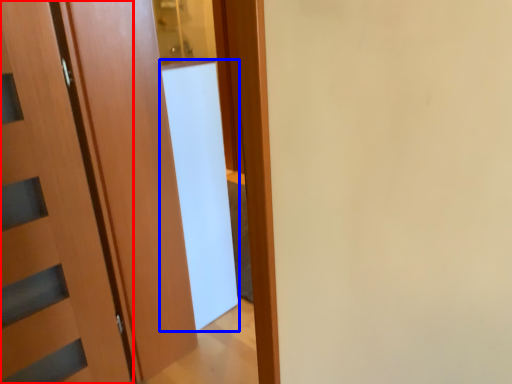
Question: Which object appears farthest to the camera in this image, door (highlighted by a red box) or screen door (highlighted by a blue box)?

Choices:
 (A) door
 (B) screen door

Answer: (B)